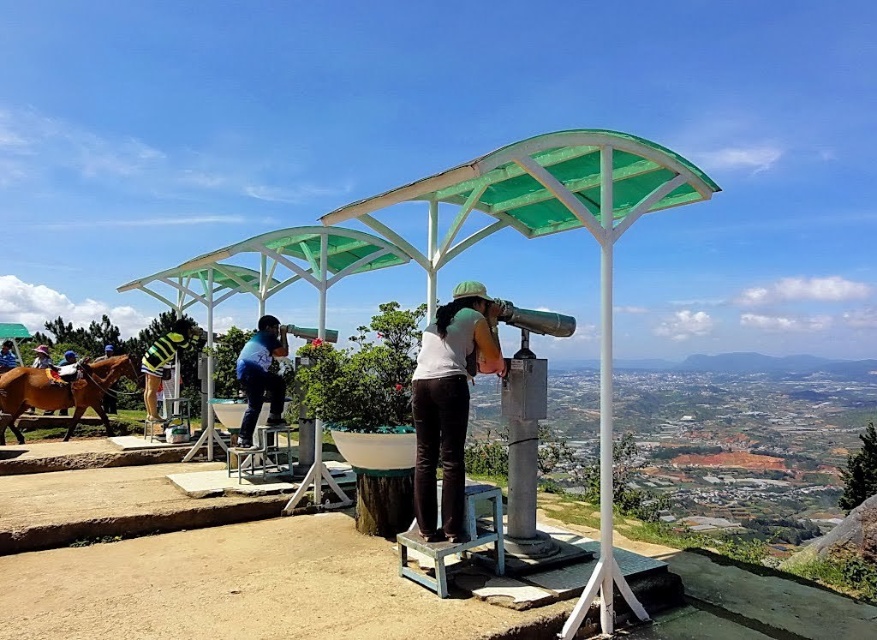
Can you confirm if brown glossy horse at left is thinner than green striped shirt at left?

Incorrect, brown glossy horse at left's width is not less than green striped shirt at left's.

Can you confirm if brown glossy horse at left is positioned to the left of green striped shirt at left?

No, brown glossy horse at left is not to the left of green striped shirt at left.

Is point (86, 388) positioned before point (111, 348)?

Yes, point (86, 388) is in front of point (111, 348).

Identify the location of brown glossy horse at left. The width and height of the screenshot is (877, 640). (61, 392).

Is point (89, 380) less distant than point (260, 317)?

That is False.

Is brown glossy horse at left positioned in front of blue fabric shirt at center?

No, brown glossy horse at left is behind blue fabric shirt at center.

The height and width of the screenshot is (640, 877). What do you see at coordinates (61, 392) in the screenshot?
I see `brown glossy horse at left` at bounding box center [61, 392].

I want to click on brown glossy horse at left, so click(x=61, y=392).

Measure the distance from white matte shirt at center to brown glossy horse at left.

white matte shirt at center is 8.30 meters away from brown glossy horse at left.

Who is positioned more to the right, white matte shirt at center or brown glossy horse at left?

white matte shirt at center

Who is more distant from viewer, (x=414, y=417) or (x=96, y=369)?

Point (x=96, y=369)

At what (x,y) coordinates should I click in order to perform the action: click on white matte shirt at center. Please return your answer as a coordinate pair (x, y). The width and height of the screenshot is (877, 640). Looking at the image, I should click on (448, 403).